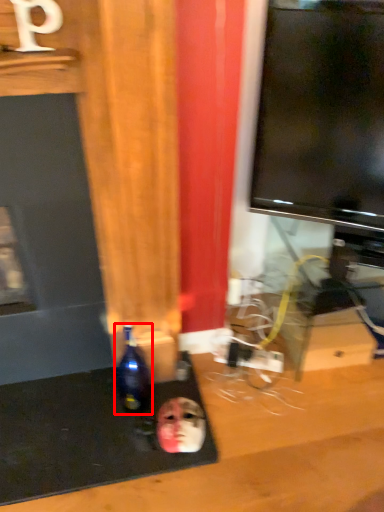
Question: From the image's perspective, where is bottle (annotated by the red box) located in relation to human face in the image?

Choices:
 (A) below
 (B) above

Answer: (B)